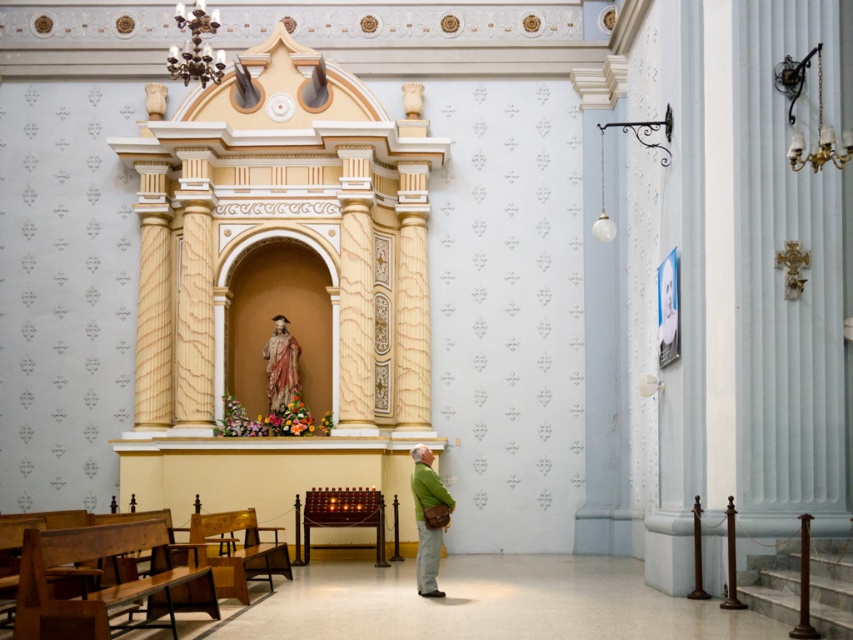
Does wooden polished bench at lower left appear under green fabric jacket at center?

Indeed, wooden polished bench at lower left is positioned under green fabric jacket at center.

How far apart are wooden polished bench at lower left and green fabric jacket at center?

A distance of 3.77 meters exists between wooden polished bench at lower left and green fabric jacket at center.

Does point (102, 532) come behind point (410, 490)?

No, it is in front of (410, 490).

This screenshot has height=640, width=853. What are the coordinates of `wooden polished bench at lower left` in the screenshot? It's located at [x=103, y=586].

Which is above, green fabric jacket at center or polychrome wood statue at center?

polychrome wood statue at center is higher up.

Is point (427, 582) positioned behind point (274, 397)?

No, (427, 582) is closer to viewer.

Which is in front, point (422, 460) or point (285, 340)?

Point (422, 460)

Image resolution: width=853 pixels, height=640 pixels. Find the location of `green fabric jacket at center`. green fabric jacket at center is located at coordinates (424, 518).

Does wooden polished bench at lower left appear over polychrome wood statue at center?

No, wooden polished bench at lower left is not above polychrome wood statue at center.

Can you confirm if wooden polished bench at lower left is positioned to the right of polychrome wood statue at center?

Incorrect, wooden polished bench at lower left is not on the right side of polychrome wood statue at center.

Between point (160, 545) and point (276, 346), which one is positioned behind?

Positioned behind is point (276, 346).

This screenshot has width=853, height=640. Identify the location of wooden polished bench at lower left. (103, 586).